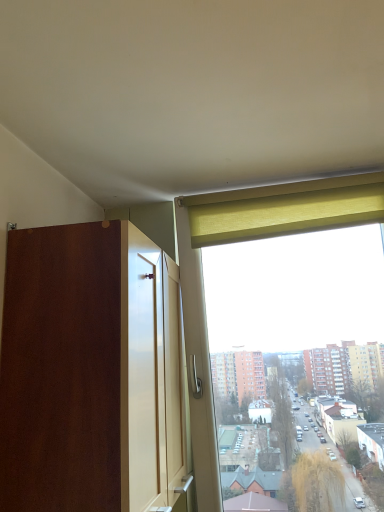
Question: Relative to green fabric curtain at upper right, is matte wood dresser at left in front or behind?

Choices:
 (A) behind
 (B) front

Answer: (B)

Question: Visually, is matte wood dresser at left positioned to the left or to the right of green fabric curtain at upper right?

Choices:
 (A) left
 (B) right

Answer: (A)

Question: From the image's perspective, is matte wood dresser at left positioned above or below green fabric curtain at upper right?

Choices:
 (A) above
 (B) below

Answer: (B)

Question: Is green fabric curtain at upper right to the left or to the right of matte wood dresser at left in the image?

Choices:
 (A) right
 (B) left

Answer: (A)

Question: Would you say green fabric curtain at upper right is inside or outside matte wood dresser at left?

Choices:
 (A) outside
 (B) inside

Answer: (A)

Question: Considering the positions of point (256, 234) and point (72, 239), is point (256, 234) closer or farther from the camera than point (72, 239)?

Choices:
 (A) closer
 (B) farther

Answer: (B)

Question: From the image's perspective, is green fabric curtain at upper right located above or below matte wood dresser at left?

Choices:
 (A) above
 (B) below

Answer: (A)